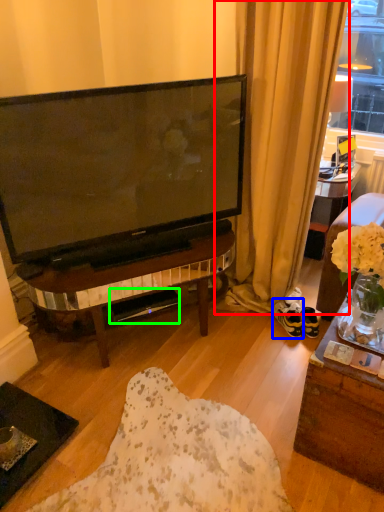
Question: Considering the real-world distances, which object is closest to curtain (highlighted by a red box)? footwear (highlighted by a blue box) or loudspeaker (highlighted by a green box).

Choices:
 (A) footwear
 (B) loudspeaker

Answer: (A)